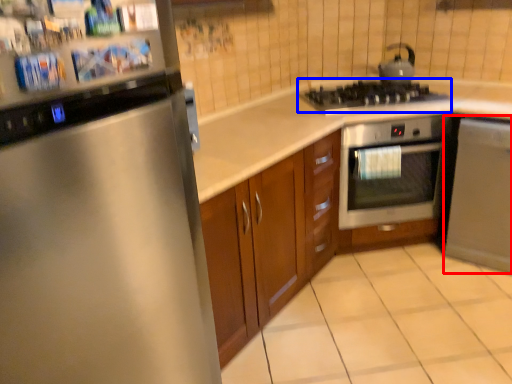
Question: Among these objects, which one is nearest to the camera, dish washer (highlighted by a red box) or gas stove (highlighted by a blue box)?

Choices:
 (A) dish washer
 (B) gas stove

Answer: (A)